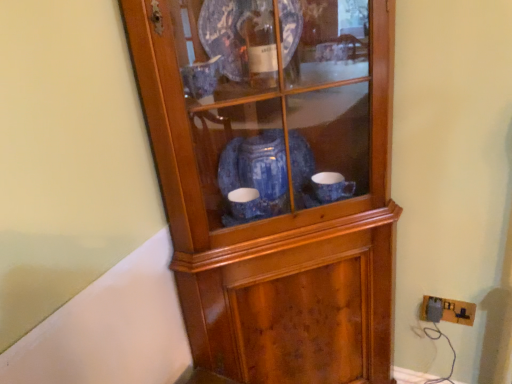
Question: From their relative heights in the image, would you say wooden cupboard at center is taller or shorter than brown cardboard electric outlet at lower right?

Choices:
 (A) tall
 (B) short

Answer: (A)

Question: Visually, is wooden cupboard at center positioned to the left or to the right of brown cardboard electric outlet at lower right?

Choices:
 (A) right
 (B) left

Answer: (B)

Question: Is wooden cupboard at center situated inside brown cardboard electric outlet at lower right or outside?

Choices:
 (A) inside
 (B) outside

Answer: (B)

Question: In the image, is brown cardboard electric outlet at lower right on the left side or the right side of wooden cupboard at center?

Choices:
 (A) left
 (B) right

Answer: (B)

Question: Relative to wooden cupboard at center, is brown cardboard electric outlet at lower right in front or behind?

Choices:
 (A) behind
 (B) front

Answer: (A)

Question: Looking at their shapes, would you say brown cardboard electric outlet at lower right is wider or thinner than wooden cupboard at center?

Choices:
 (A) wide
 (B) thin

Answer: (B)

Question: Does point (471, 309) appear closer or farther from the camera than point (239, 89)?

Choices:
 (A) farther
 (B) closer

Answer: (A)